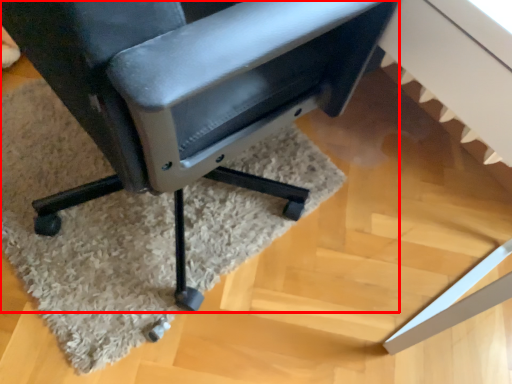
Question: From the image's perspective, what is the correct spatial relationship of chair (annotated by the red box) in relation to mat?

Choices:
 (A) below
 (B) above

Answer: (B)